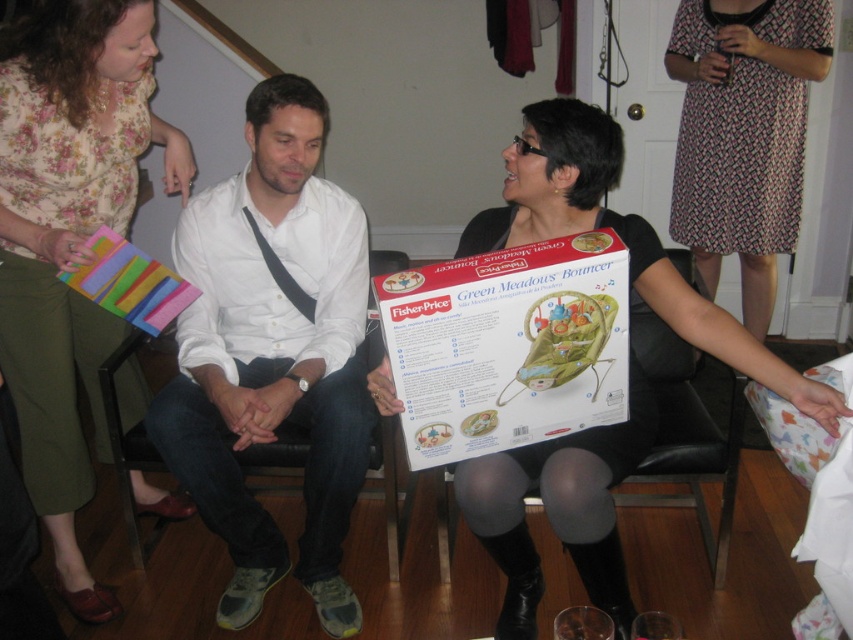
You are at a party and see two people wearing the white matte shirt at center and the floral fabric blouse at upper left. Which one is standing more to the right?

The white matte shirt at center is more to the right than the floral fabric blouse at upper left.

You are at a baby shower and need to place the matte black bouncer at center and the white cardboard box at center on a shelf. The shelf has limited space. Which object should you place first to ensure both fit properly?

The matte black bouncer at center is positioned under the white cardboard box at center, so you should place the matte black bouncer at center first to ensure there is enough space for the white cardboard box at center on top of it.

You are standing at the origin of the coordinate system in the image. You want to move towards the point at point [241,227]. Will you pass through point [73,134] first?

Yes, because point [241,227] is behind point [73,134], so you will pass through point [73,134] first when moving towards point [241,227].